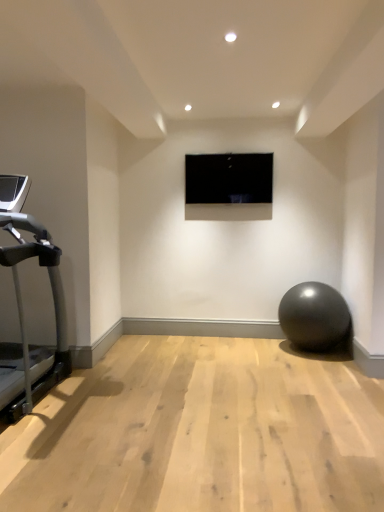
I want to click on black glossy screen at center, so click(x=229, y=178).

The height and width of the screenshot is (512, 384). I want to click on matte gray ball at lower right, so click(314, 316).

Is black glossy screen at center next to matte gray ball at lower right?

black glossy screen at center and matte gray ball at lower right are not in contact.

Does black glossy screen at center have a lesser width compared to matte gray ball at lower right?

Yes, black glossy screen at center is thinner than matte gray ball at lower right.

Which object is positioned more to the left, black glossy screen at center or matte gray ball at lower right?

black glossy screen at center.

From the image's perspective, which one is positioned higher, silver metallic treadmill at left or black glossy screen at center?

From the image's view, black glossy screen at center is above.

Which of these two, silver metallic treadmill at left or black glossy screen at center, stands shorter?

black glossy screen at center.

Looking at their sizes, would you say silver metallic treadmill at left is wider or thinner than black glossy screen at center?

In the image, silver metallic treadmill at left appears to be wider than black glossy screen at center.

Between silver metallic treadmill at left and black glossy screen at center, which one has smaller size?

Smaller between the two is black glossy screen at center.

In the scene shown: Can you tell me how much black glossy screen at center and silver metallic treadmill at left differ in facing direction?

The angle between the facing direction of black glossy screen at center and the facing direction of silver metallic treadmill at left is 90.9 degrees.

Does black glossy screen at center touch silver metallic treadmill at left?

No, black glossy screen at center is not next to silver metallic treadmill at left.

Is black glossy screen at center wider than silver metallic treadmill at left?

No, black glossy screen at center is not wider than silver metallic treadmill at left.

From a real-world perspective, is black glossy screen at center physically located above or below silver metallic treadmill at left?

black glossy screen at center is situated higher than silver metallic treadmill at left in the real world.

Where is `ball that appears on the right of silver metallic treadmill at left`? The height and width of the screenshot is (512, 384). ball that appears on the right of silver metallic treadmill at left is located at coordinates (314, 316).

From a real-world perspective, which is physically below, silver metallic treadmill at left or matte gray ball at lower right?

matte gray ball at lower right, from a real-world perspective.

Does point (28, 250) lie in front of point (320, 327)?

Yes, point (28, 250) is closer to viewer.

Are matte gray ball at lower right and black glossy screen at center far apart?

Yes, matte gray ball at lower right and black glossy screen at center are located far from each other.

Is point (305, 293) positioned after point (195, 157)?

That is False.

Is matte gray ball at lower right oriented towards black glossy screen at center?

No, matte gray ball at lower right does not turn towards black glossy screen at center.

Is matte gray ball at lower right shorter than black glossy screen at center?

No.

Is matte gray ball at lower right positioned far away from silver metallic treadmill at left?

matte gray ball at lower right is positioned a significant distance from silver metallic treadmill at left.

Considering the sizes of objects matte gray ball at lower right and silver metallic treadmill at left in the image provided, who is thinner, matte gray ball at lower right or silver metallic treadmill at left?

Thinner between the two is matte gray ball at lower right.

Locate an element on the screen. The height and width of the screenshot is (512, 384). treadmill that is above the matte gray ball at lower right (from the image's perspective) is located at coordinates (20, 293).

This screenshot has height=512, width=384. Identify the location of computer screen lying behind the matte gray ball at lower right. pos(229,178).

The image size is (384, 512). Identify the location of treadmill located underneath the black glossy screen at center (from a real-world perspective). (20, 293).

Estimate the real-world distances between objects in this image. Which object is closer to silver metallic treadmill at left, black glossy screen at center or matte gray ball at lower right?

Based on the image, black glossy screen at center appears to be nearer to silver metallic treadmill at left.

Considering their positions, is matte gray ball at lower right positioned further to black glossy screen at center than silver metallic treadmill at left?

Among the two, silver metallic treadmill at left is located further to black glossy screen at center.

Looking at the image, which one is located further to matte gray ball at lower right, black glossy screen at center or silver metallic treadmill at left?

silver metallic treadmill at left is positioned further to the anchor matte gray ball at lower right.

Estimate the real-world distances between objects in this image. Which object is closer to black glossy screen at center, silver metallic treadmill at left or matte gray ball at lower right?

matte gray ball at lower right.

Based on their spatial positions, is silver metallic treadmill at left or black glossy screen at center closer to matte gray ball at lower right?

black glossy screen at center.

Considering their positions, is matte gray ball at lower right positioned further to silver metallic treadmill at left than black glossy screen at center?

Based on the image, matte gray ball at lower right appears to be further to silver metallic treadmill at left.

Identify the location of computer screen between silver metallic treadmill at left and matte gray ball at lower right. The width and height of the screenshot is (384, 512). (229, 178).